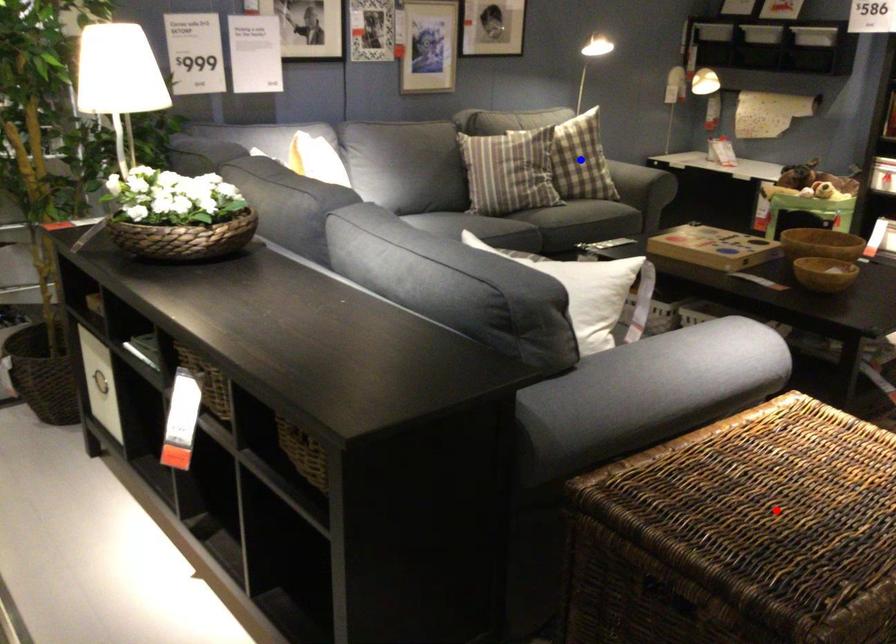
Question: In the image, two points are highlighted. Which point is nearer to the camera? Reply with the corresponding letter.

Choices:
 (A) blue point
 (B) red point

Answer: (B)